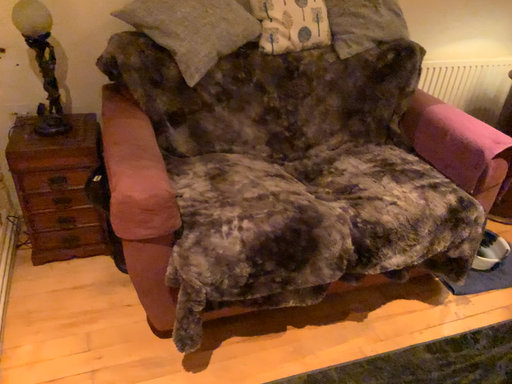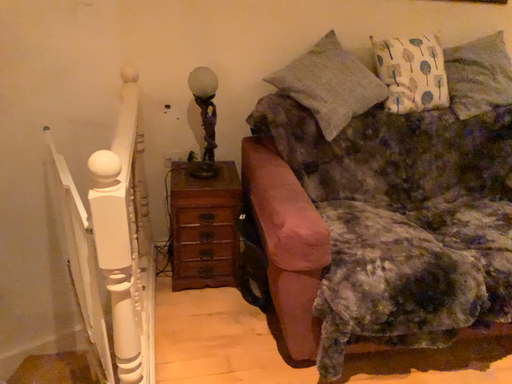
Question: Which way did the camera rotate in the video?

Choices:
 (A) rotated left
 (B) rotated right

Answer: (A)